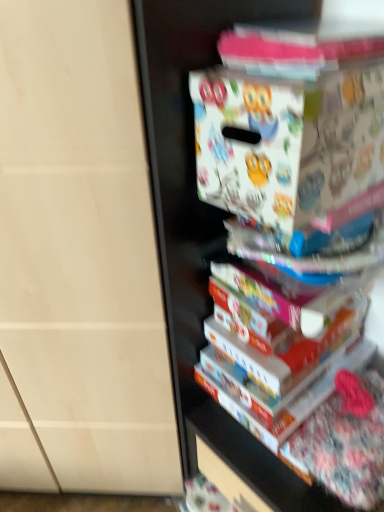
The image size is (384, 512). Find the location of `white glossy book at center`. white glossy book at center is located at coordinates (277, 359).

Measure the distance between white glossy book at center and camera.

white glossy book at center and camera are 27.58 inches apart from each other.

What do you see at coordinates (277, 359) in the screenshot? The image size is (384, 512). I see `white glossy book at center` at bounding box center [277, 359].

At what (x,y) coordinates should I click in order to perform the action: click on white matte board game box at upper right. Please return your answer as a coordinate pair (x, y). This screenshot has height=512, width=384. Looking at the image, I should click on (290, 147).

What do you see at coordinates (290, 147) in the screenshot? I see `white matte board game box at upper right` at bounding box center [290, 147].

Locate an element on the screen. This screenshot has height=512, width=384. white glossy book at center is located at coordinates (277, 359).

Does white glossy book at center appear on the right side of white matte board game box at upper right?

Yes.

Considering their positions, is white glossy book at center located in front of or behind white matte board game box at upper right?

In the image, white glossy book at center appears behind white matte board game box at upper right.

Is point (228, 321) positioned in front of point (290, 127)?

No, it is behind (290, 127).

From the image's perspective, which object appears higher, white glossy book at center or white matte board game box at upper right?

white matte board game box at upper right appears higher in the image.

From a real-world perspective, is white glossy book at center physically above white matte board game box at upper right?

No, from a real-world perspective, white glossy book at center is not above white matte board game box at upper right.

Considering the sizes of objects white glossy book at center and white matte board game box at upper right in the image provided, who is wider, white glossy book at center or white matte board game box at upper right?

Wider between the two is white glossy book at center.

Between white glossy book at center and white matte board game box at upper right, which one has more height?

white matte board game box at upper right is taller.

Can you confirm if white glossy book at center is bigger than white matte board game box at upper right?

Actually, white glossy book at center might be smaller than white matte board game box at upper right.

Can white matte board game box at upper right be found inside white glossy book at center?

No, white glossy book at center does not contain white matte board game box at upper right.

Are white glossy book at center and white matte board game box at upper right far apart?

No, white glossy book at center is in close proximity to white matte board game box at upper right.

Is white glossy book at center oriented towards white matte board game box at upper right?

No, white glossy book at center is not aimed at white matte board game box at upper right.

Locate an element on the screen. The height and width of the screenshot is (512, 384). paperback book to the left of white glossy book at center is located at coordinates (290, 147).

Between white matte board game box at upper right and white glossy book at center, which one appears on the left side from the viewer's perspective?

Positioned to the left is white matte board game box at upper right.

In the image, is white matte board game box at upper right positioned in front of or behind white glossy book at center?

In the image, white matte board game box at upper right appears in front of white glossy book at center.

Which is in front, point (369, 127) or point (210, 386)?

Point (369, 127)

From the image's perspective, would you say white matte board game box at upper right is positioned over white glossy book at center?

Yes, from the image's perspective, white matte board game box at upper right is on top of white glossy book at center.

From the picture: From a real-world perspective, between white matte board game box at upper right and white glossy book at center, who is vertically lower?

white glossy book at center.

Is white matte board game box at upper right thinner than white glossy book at center?

Yes, white matte board game box at upper right is thinner than white glossy book at center.

From their relative heights in the image, would you say white matte board game box at upper right is taller or shorter than white glossy book at center?

In the image, white matte board game box at upper right appears to be taller than white glossy book at center.

Considering the relative sizes of white matte board game box at upper right and white glossy book at center in the image provided, is white matte board game box at upper right smaller than white glossy book at center?

No.

Is white matte board game box at upper right completely or partially outside of white glossy book at center?

Yes, white matte board game box at upper right is not within white glossy book at center.

Is white matte board game box at upper right not near white glossy book at center?

No, white matte board game box at upper right is not far from white glossy book at center.

Could you tell me if white matte board game box at upper right is turned towards white glossy book at center?

No, white matte board game box at upper right does not turn towards white glossy book at center.

How different are the orientations of white matte board game box at upper right and white glossy book at center in degrees?

The angular difference between white matte board game box at upper right and white glossy book at center is 0.67 degrees.

Where is `book below the white matte board game box at upper right (from the image's perspective)`? book below the white matte board game box at upper right (from the image's perspective) is located at coordinates (277, 359).

The image size is (384, 512). In order to click on paperback book that appears in front of the white glossy book at center in this screenshot , I will do `click(290, 147)`.

Find the location of `paperback book above the white glossy book at center (from a real-world perspective)`. paperback book above the white glossy book at center (from a real-world perspective) is located at coordinates (290, 147).